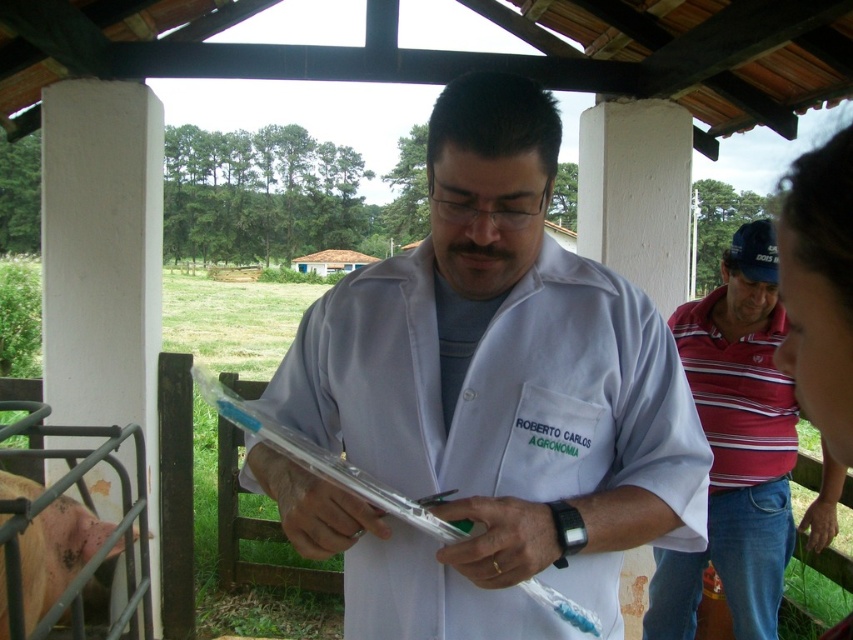
Is white lab coat at center further to camera compared to striped cotton polo shirt at right?

That is False.

Is point (596, 589) closer to camera compared to point (775, 388)?

That is True.

Does point (531, 156) come in front of point (788, 394)?

Yes, point (531, 156) is in front of point (788, 394).

The height and width of the screenshot is (640, 853). What are the coordinates of `white lab coat at center` in the screenshot? It's located at (486, 401).

Who is more distant from viewer, (344, 536) or (94, 536)?

The point (94, 536) is behind.

Can you confirm if white lab coat at center is positioned above pinkish-brown skin at lower left?

Indeed, white lab coat at center is positioned over pinkish-brown skin at lower left.

Locate an element on the screen. The width and height of the screenshot is (853, 640). white lab coat at center is located at coordinates point(486,401).

Find the location of `white lab coat at center`. white lab coat at center is located at coordinates (486, 401).

Can you confirm if striped cotton polo shirt at right is shorter than pinkish-brown skin at lower left?

No, striped cotton polo shirt at right is not shorter than pinkish-brown skin at lower left.

From the picture: Is striped cotton polo shirt at right further to camera compared to pinkish-brown skin at lower left?

Yes.

Between point (776, 342) and point (90, 544), which one is positioned in front?

Point (90, 544)

At what (x,y) coordinates should I click in order to perform the action: click on striped cotton polo shirt at right. Please return your answer as a coordinate pair (x, y). Looking at the image, I should click on (735, 445).